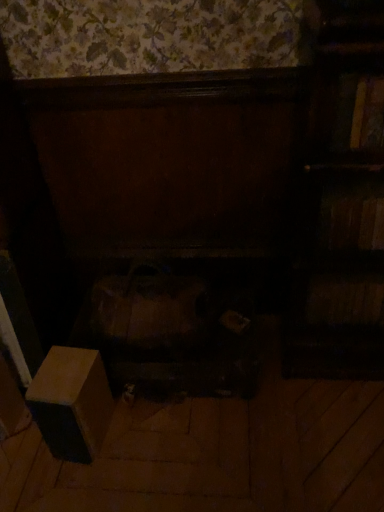
Image resolution: width=384 pixels, height=512 pixels. What do you see at coordinates (71, 402) in the screenshot?
I see `matte brown cardboard box at lower left` at bounding box center [71, 402].

Locate an element on the screen. matte brown cardboard box at lower left is located at coordinates tap(71, 402).

Image resolution: width=384 pixels, height=512 pixels. Identify the location of matte brown cardboard box at lower left. (71, 402).